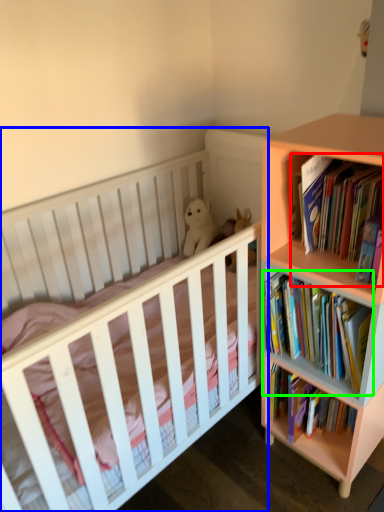
Question: Which object is positioned closest to book (highlighted by a red box)? Select from infant bed (highlighted by a blue box) and book (highlighted by a green box).

Choices:
 (A) infant bed
 (B) book

Answer: (B)